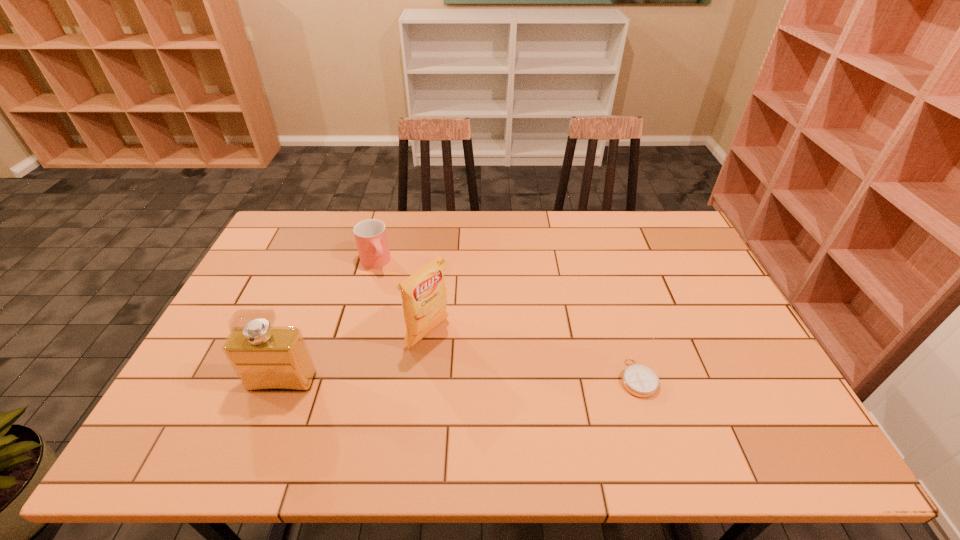
Find the location of a particular element. The width and height of the screenshot is (960, 540). free space that is in between the perfume and the cup is located at coordinates (328, 322).

This screenshot has height=540, width=960. What are the coordinates of `empty space between the leftmost object and the second object from left to right` in the screenshot? It's located at (328, 322).

The height and width of the screenshot is (540, 960). I want to click on empty space between the compass and the leftmost object, so click(460, 380).

The width and height of the screenshot is (960, 540). I want to click on empty space between the leftmost object and the cup, so click(x=328, y=322).

Choose which object is the second nearest neighbor to the shortest object. Please provide its 2D coordinates. Your answer should be formatted as a tuple, i.e. [(x, y)], where the tuple contains the x and y coordinates of a point satisfying the conditions above.

[(370, 235)]

Find the location of a particular element. object that stands as the third closest to the leftmost object is located at coordinates [x=639, y=380].